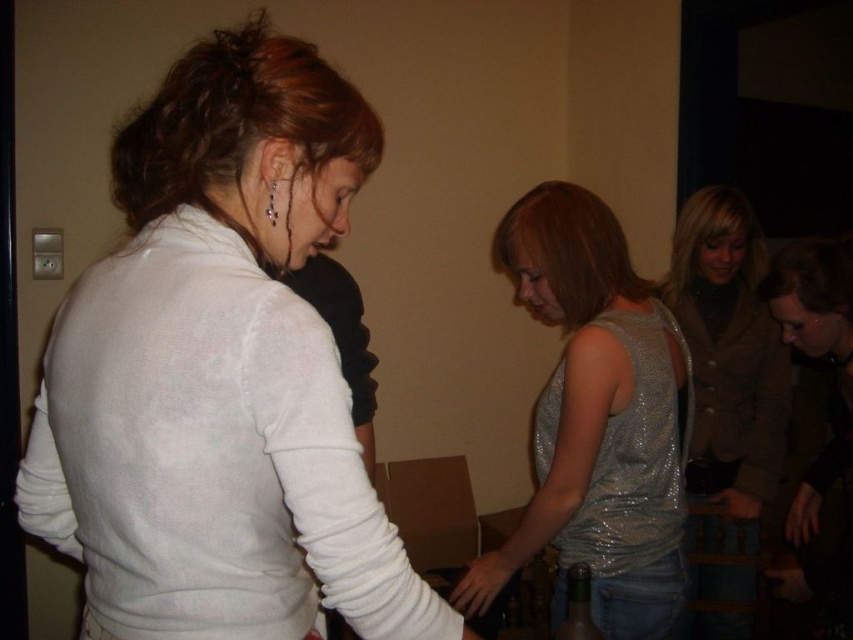
Question: Does sparkly silver tank top at center appear on the left side of smooth skin hand at center?

Choices:
 (A) yes
 (B) no

Answer: (B)

Question: Which of the following is the closest to the observer?

Choices:
 (A) (258, 36)
 (B) (724, 579)
 (C) (508, 582)
 (D) (729, 496)

Answer: (A)

Question: Does sparkly silver tank top at center have a smaller size compared to smooth skin hand at center?

Choices:
 (A) yes
 (B) no

Answer: (B)

Question: Which of the following is the closest to the observer?

Choices:
 (A) (741, 438)
 (B) (741, 497)
 (C) (496, 548)

Answer: (B)

Question: Estimate the real-world distances between objects in this image. Which object is closer to the sparkly silver dress at center?

Choices:
 (A) sparkly silver tank top at center
 (B) smooth skin hand at center
 (C) white matte sweater at upper left
 (D) matte black hand at lower right

Answer: (D)

Question: Where is white matte sweater at upper left located in relation to sparkly silver dress at center in the image?

Choices:
 (A) right
 (B) left

Answer: (B)